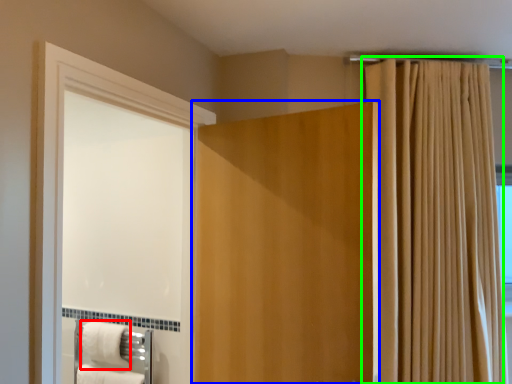
Question: Estimate the real-world distances between objects in this image. Which object is closer to bath towel (highlighted by a red box), door (highlighted by a blue box) or curtain (highlighted by a green box)?

Choices:
 (A) door
 (B) curtain

Answer: (A)